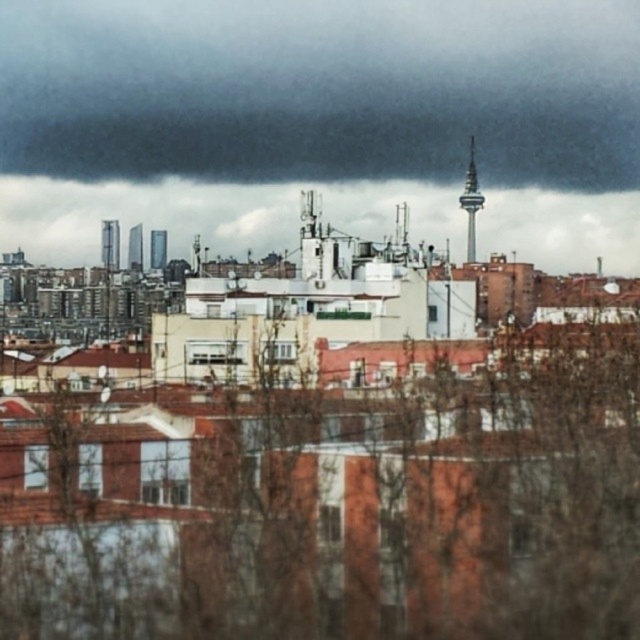
Question: Is dark gray cloud at upper center smaller than cloudy sky at upper center?

Choices:
 (A) yes
 (B) no

Answer: (B)

Question: Among these objects, which one is farthest from the camera?

Choices:
 (A) cloudy sky at upper center
 (B) dark gray cloud at upper center

Answer: (B)

Question: Is dark gray cloud at upper center smaller than cloudy sky at upper center?

Choices:
 (A) yes
 (B) no

Answer: (B)

Question: Among these objects, which one is nearest to the camera?

Choices:
 (A) cloudy sky at upper center
 (B) dark gray cloud at upper center

Answer: (A)

Question: Which object is closer to the camera taking this photo?

Choices:
 (A) cloudy sky at upper center
 (B) dark gray cloud at upper center

Answer: (A)

Question: Is dark gray cloud at upper center positioned behind cloudy sky at upper center?

Choices:
 (A) no
 (B) yes

Answer: (B)